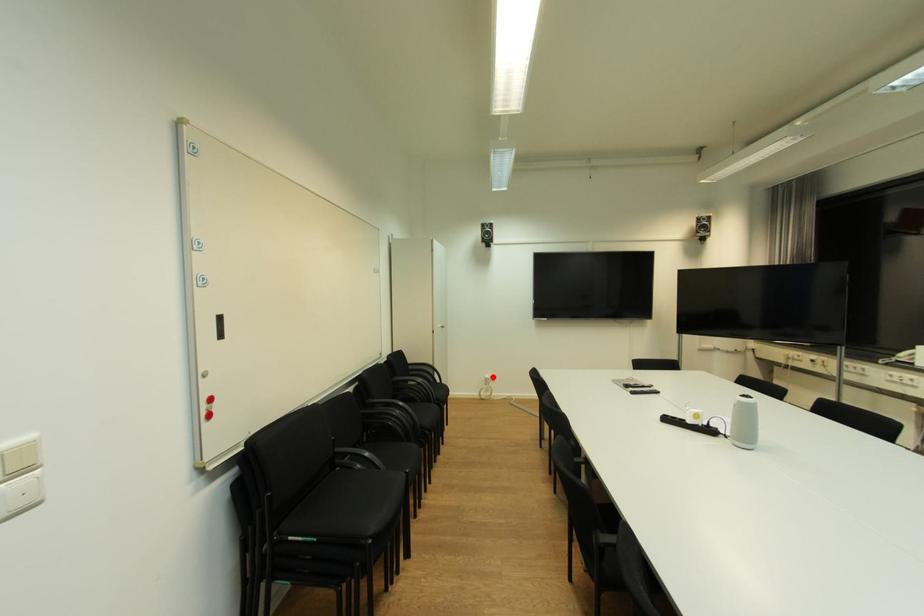
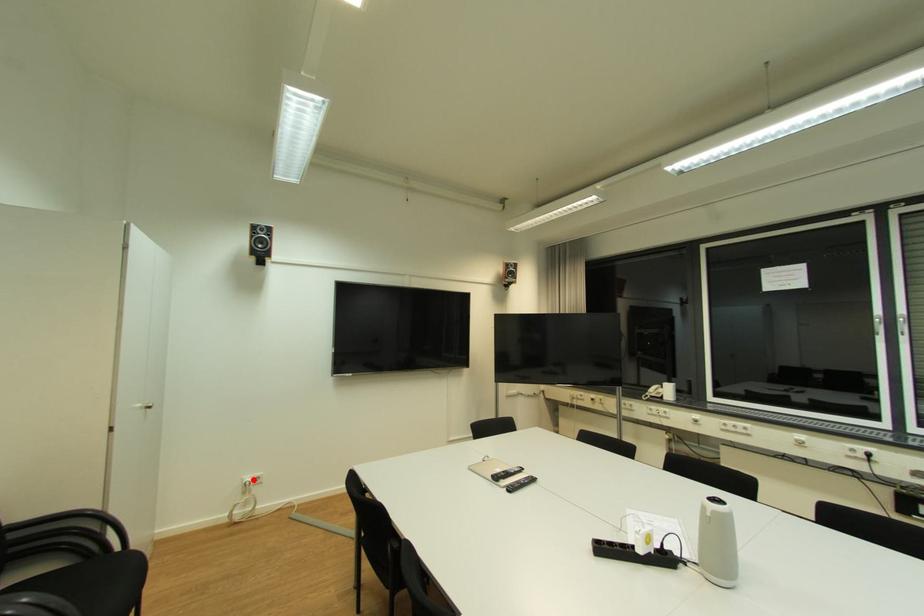
I am providing you with two images of the same scene from different viewpoints. A red point is marked on the first image and another point is marked on the second image. Do the highlighted points in image1 and image2 indicate the same real-world spot?

Yes